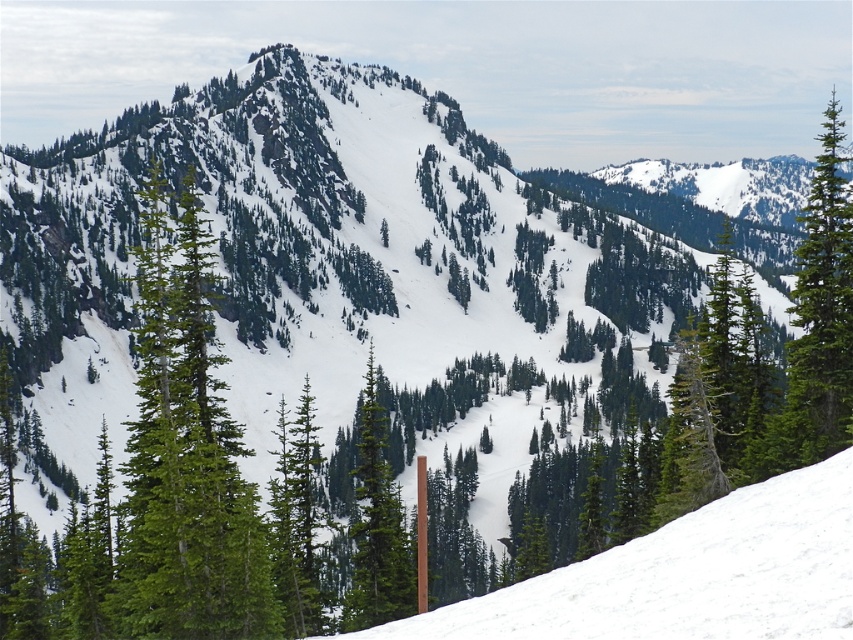
Question: Which point is farther from the camera taking this photo?

Choices:
 (A) (828, 358)
 (B) (207, 636)

Answer: (A)

Question: Is green matte tree at center closer to camera compared to green matte tree at right?

Choices:
 (A) no
 (B) yes

Answer: (B)

Question: Observing the image, what is the correct spatial positioning of green matte tree at center in reference to green matte tree at right?

Choices:
 (A) below
 (B) above

Answer: (A)

Question: Where is green matte tree at center located in relation to green matte tree at right in the image?

Choices:
 (A) above
 (B) below

Answer: (B)

Question: Among these points, which one is farthest from the camera?

Choices:
 (A) (151, 525)
 (B) (820, 246)

Answer: (B)